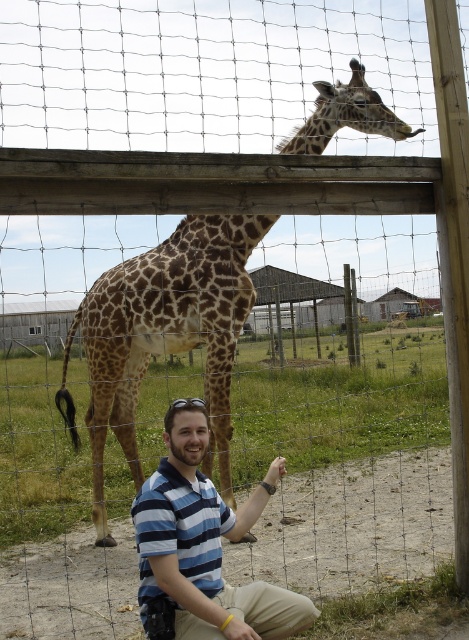
Who is more distant from viewer, (353, 116) or (263, 499)?

Point (353, 116)

Does spotted brown giraffe at upper center have a larger size compared to blue striped shirt at lower center?

Correct, spotted brown giraffe at upper center is larger in size than blue striped shirt at lower center.

This screenshot has height=640, width=469. What do you see at coordinates (165, 336) in the screenshot? I see `spotted brown giraffe at upper center` at bounding box center [165, 336].

Identify the location of spotted brown giraffe at upper center. This screenshot has width=469, height=640. (165, 336).